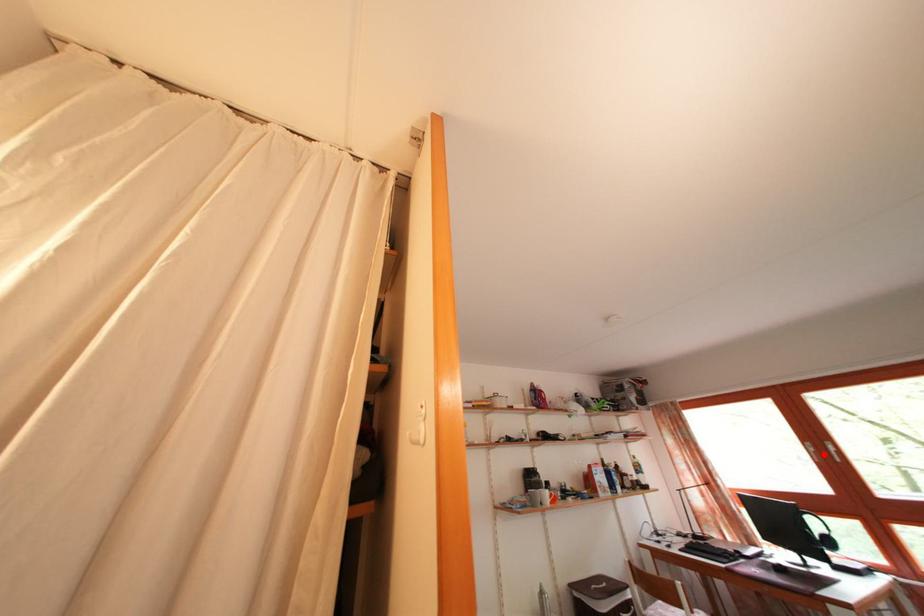
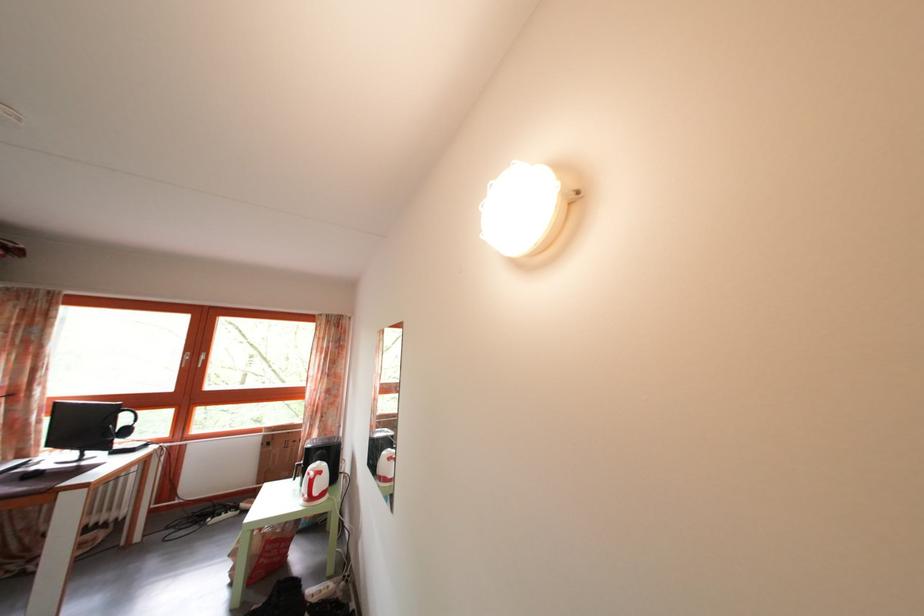
Question: A red point is marked in image1. In image2, is the corresponding 3D point closer to the camera or farther? Reply with the corresponding letter.

Choices:
 (A) The corresponding 3D point is closer.
 (B) The corresponding 3D point is farther.

Answer: (B)